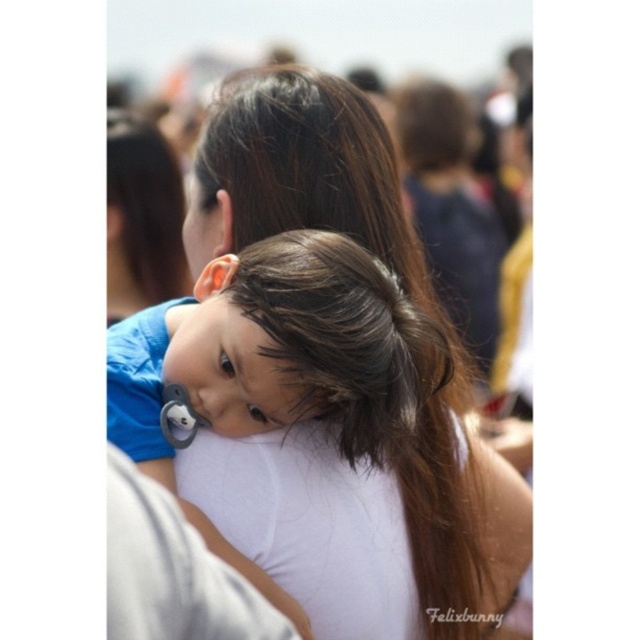
Question: Which point is farther from the camera taking this photo?

Choices:
 (A) (166, 541)
 (B) (292, 461)
 (C) (404, 508)

Answer: (C)

Question: Does brown smooth hair at center have a greater width compared to white fabric shoulder at center?

Choices:
 (A) yes
 (B) no

Answer: (A)

Question: Which point is farther to the camera?

Choices:
 (A) (298, 193)
 (B) (442, 477)
 (C) (109, 600)

Answer: (B)

Question: Among these objects, which one is farthest from the camera?

Choices:
 (A) brown smooth hair at center
 (B) white fabric shoulder at center
 (C) white fabric at center

Answer: (C)

Question: Does brown smooth hair at center appear over white fabric shoulder at center?

Choices:
 (A) no
 (B) yes

Answer: (B)

Question: Is white fabric at center bigger than brown smooth hair at center?

Choices:
 (A) no
 (B) yes

Answer: (B)